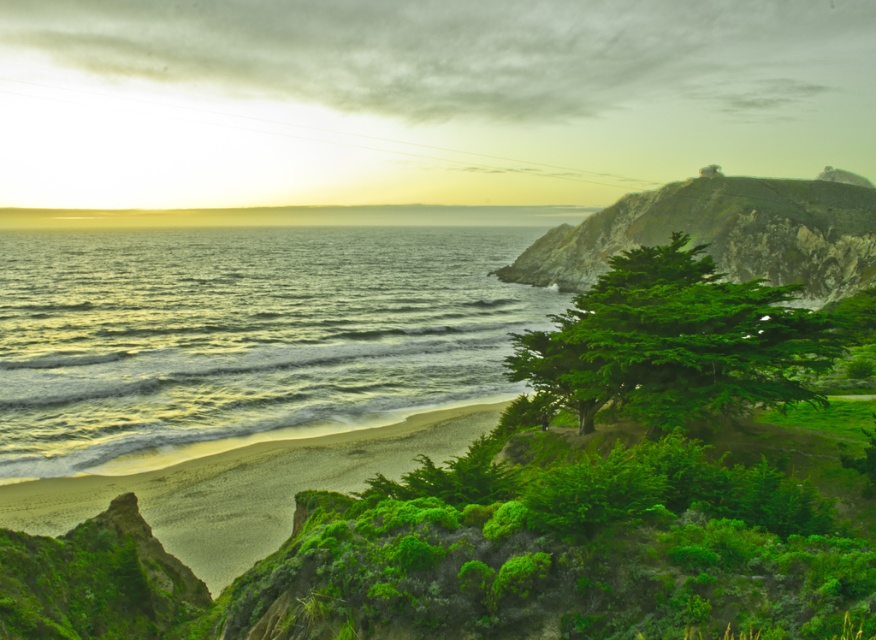
You are standing on the beach looking towards the cliffs. Which object is positioned to the left of the other between the green leafy tree at center and the green mossy cliff at upper right?

The green leafy tree at center is positioned to the left of the green mossy cliff at upper right.